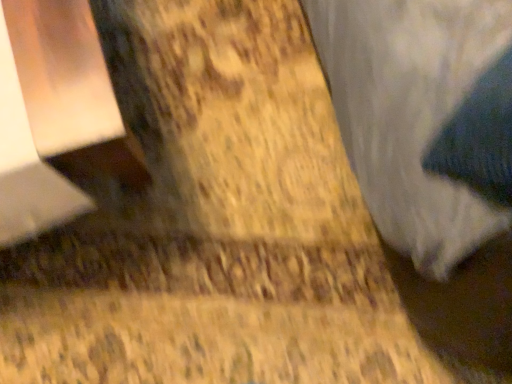
The image size is (512, 384). What do you see at coordinates (410, 112) in the screenshot?
I see `gray fabric curtain at lower right` at bounding box center [410, 112].

Where is `gray fabric curtain at lower right`? This screenshot has height=384, width=512. gray fabric curtain at lower right is located at coordinates (410, 112).

This screenshot has width=512, height=384. In order to click on gray fabric curtain at lower right in this screenshot , I will do `click(410, 112)`.